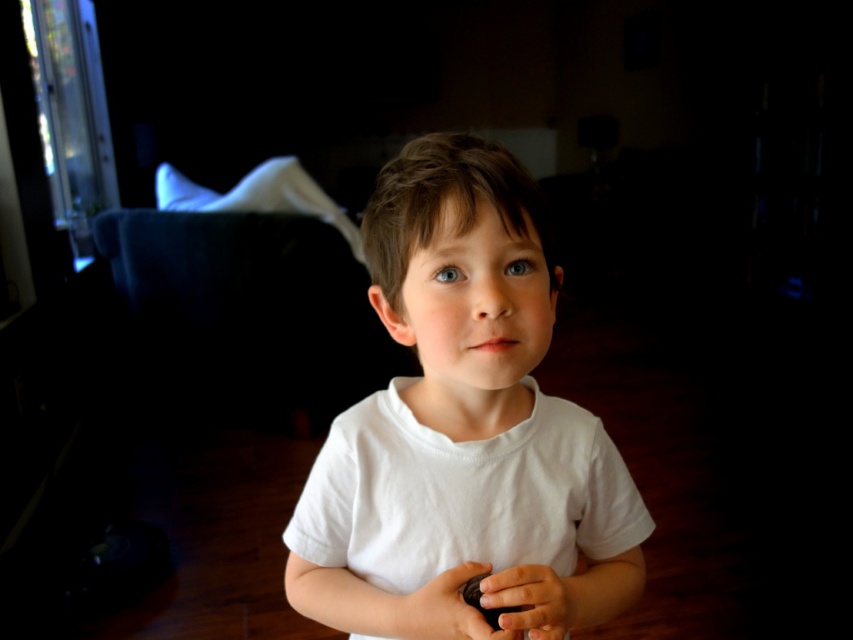
Question: Is white cotton shirt at center bigger than smooth skin hand at center?

Choices:
 (A) yes
 (B) no

Answer: (A)

Question: Which object is closer to the camera taking this photo?

Choices:
 (A) smooth skin hand at center
 (B) white cotton shirt at center

Answer: (B)

Question: Which object is positioned farthest from the smooth brown object at center?

Choices:
 (A) white cotton shirt at center
 (B) smooth skin hand at center

Answer: (A)

Question: Where is white cotton shirt at center located in relation to smooth brown object at center in the image?

Choices:
 (A) below
 (B) above

Answer: (B)

Question: Considering the real-world distances, which object is farthest from the white cotton shirt at center?

Choices:
 (A) smooth skin hand at center
 (B) smooth brown object at center

Answer: (A)

Question: Is white cotton shirt at center wider than smooth skin hand at center?

Choices:
 (A) yes
 (B) no

Answer: (A)